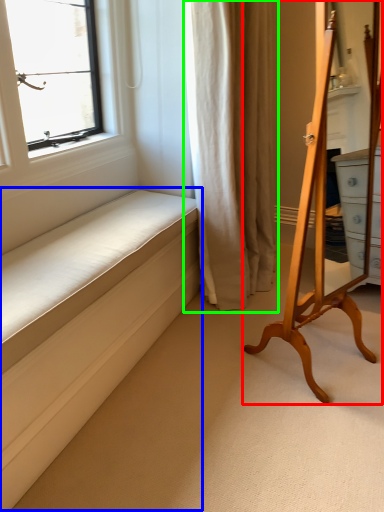
Question: Considering the real-world distances, which object is closest to furniture (highlighted by a red box)? bed frame (highlighted by a blue box) or curtain (highlighted by a green box).

Choices:
 (A) bed frame
 (B) curtain

Answer: (B)